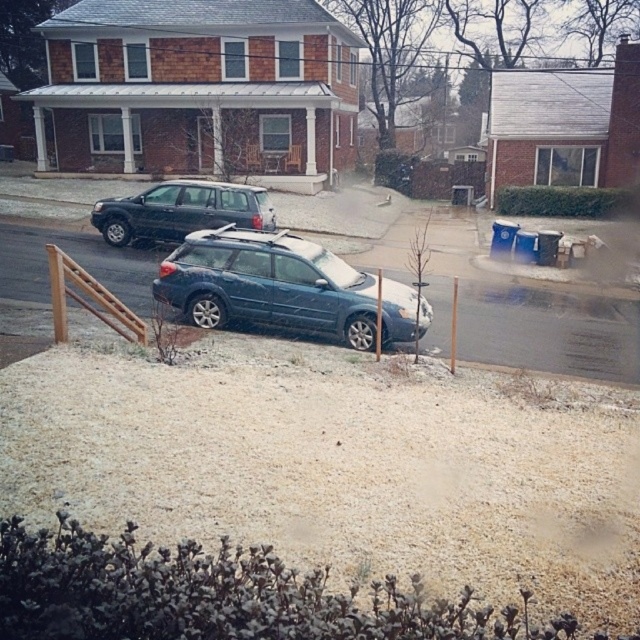
You are standing at the point with coordinates point (236, 220) and want to walk to the point with coordinates point (204, 232). Which direction should you move to reach your destination?

You should move forward because point (204, 232) is in front of point (236, 220).

You are a delivery person trying to park your 5.5 meter long delivery van between the satin blue station wagon at center and the matte black suv at center. Based on the scene, can you fit your van between them?

The distance between the satin blue station wagon at center and the matte black suv at center is 8.77 meters. Since your van is 5.5 meters long, there is enough space to park between them as 8.77 meters is greater than 5.5 meters.

You are standing at the point of origin in the residential street scene. Where is the satin blue station wagon at center located?

The satin blue station wagon at center is located at point (x=284, y=288).